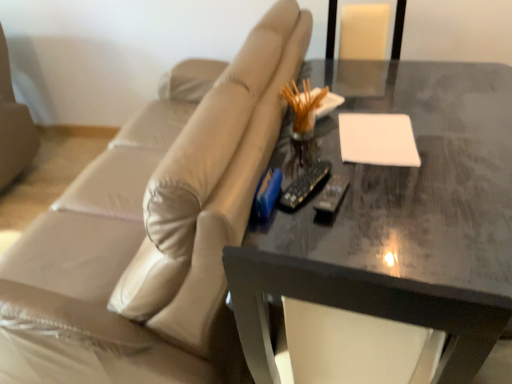
Find the location of a particular element. This screenshot has width=512, height=384. vacant space situated above shiny dark gray table at center (from a real-world perspective) is located at coordinates (405, 143).